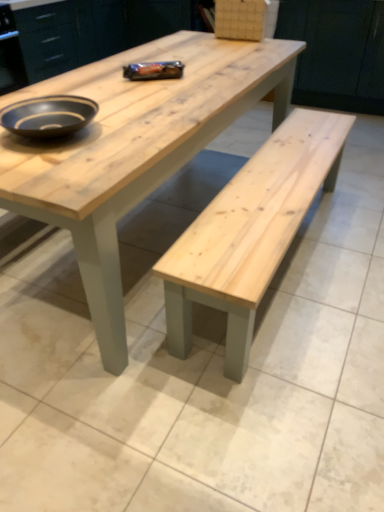
This screenshot has height=512, width=384. What are the coordinates of `vacant space in natural wood bench at center (from a real-world perspective)` in the screenshot? It's located at (153, 231).